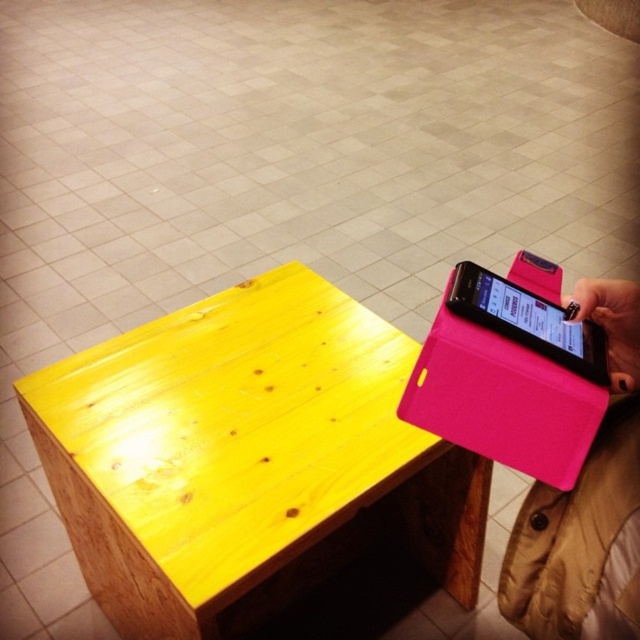
You are a cashier at a store and need to place a customer payment card on the table. The payment card is 10 cm long. The table is 1 meter long. Where on the table should you place the card so that it is centered and aligned with the pink leather wallet at lower right?

The pink leather wallet at lower right is located at point (586, 506) in 2D coordinates. To center the payment card, place it so its midpoint aligns with the wallet. Since the card is 10 cm long and the table is 100 cm long, the card should be placed from 0.792 minus 0.05 meters to 0.792 plus 0.05 meters along the x or y axis corresponding to the wallet position.

You are standing at the origin point in the image. There is a pink leather wallet at lower right marked by point (586, 506). Can you tell me the direction of the pink leather wallet relative to your current position?

The pink leather wallet at lower right is located to the lower right direction from the origin point.